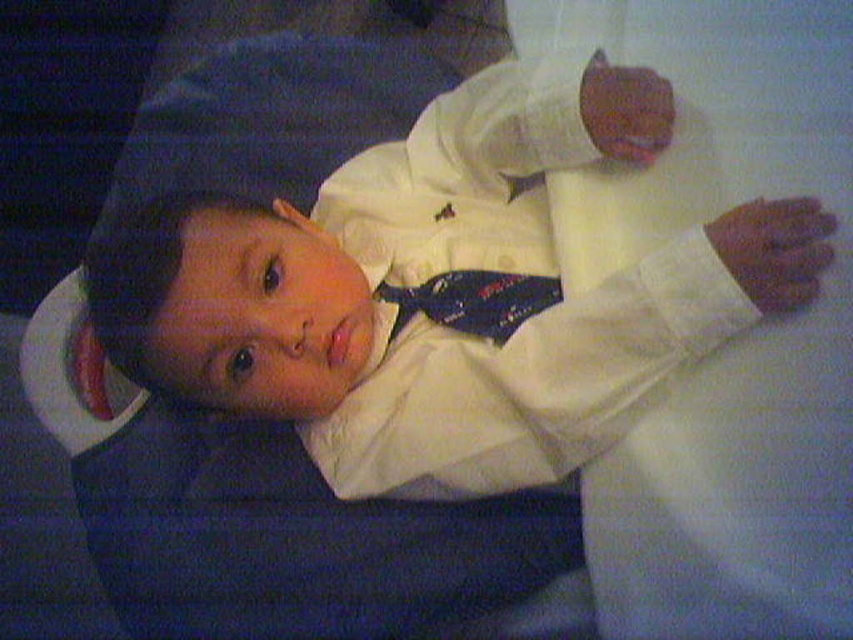
You are a photographer adjusting your camera to focus on the two points in the scene. The first point is at coordinates point [204,404] and the second is at point [515,292]. Based on their positions, which point should you focus on first to ensure the foreground is sharp?

Point [204,404] is in front of point [515,292], so you should focus on point [204,404] first to capture the foreground clearly.

You are a photographer setting up for a portrait shoot. The subject is wearing a white satin suit at center and you need to position your camera so that it is exactly 24 inches away from the suit. Based on the scene description, is the camera currently positioned correctly?

The white satin suit at center and camera are 23.93 inches apart from each other, which is very close to the desired 24 inches. Depending on the required precision, the photographer might need to adjust the camera position slightly to ensure it is exactly 24 inches away.

Based on the scene description, which object is taller between the white satin suit at center and the blue satin tie at center?

The white satin suit at center is taller than the blue satin tie at center according to the description.